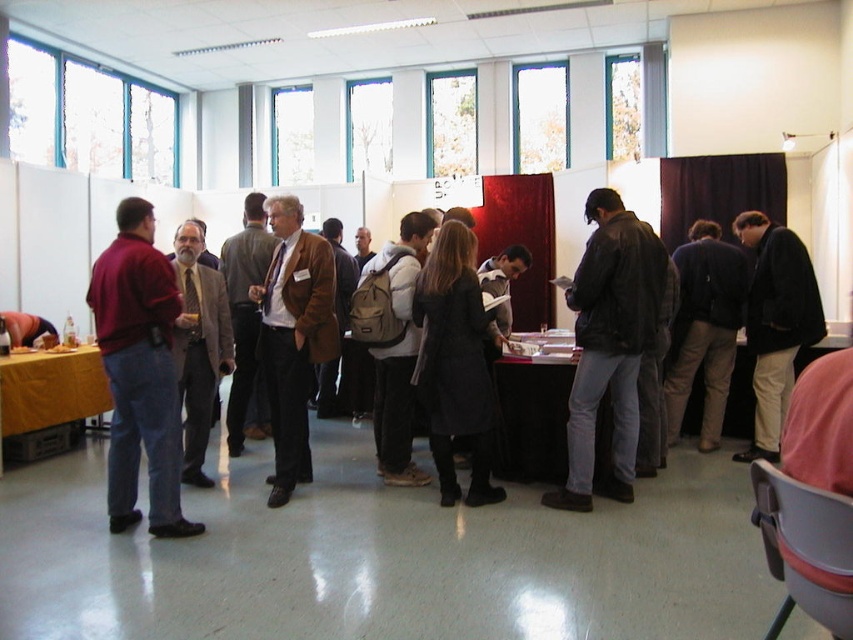
Who is taller, brown leather jacket at center or brown textured suit at center?

Standing taller between the two is brown leather jacket at center.

Does point (302, 412) come closer to viewer compared to point (181, 333)?

No, it is not.

At what (x,y) coordinates should I click in order to perform the action: click on brown leather jacket at center. Please return your answer as a coordinate pair (x, y). This screenshot has height=640, width=853. Looking at the image, I should click on (293, 337).

Is point (120, 477) closer to viewer compared to point (306, 330)?

Yes.

Does matte red shirt at left have a greater width compared to brown leather jacket at center?

No.

Is point (154, 483) farther from viewer compared to point (293, 465)?

No, (154, 483) is closer to viewer.

At what (x,y) coordinates should I click in order to perform the action: click on matte red shirt at left. Please return your answer as a coordinate pair (x, y). Looking at the image, I should click on (138, 371).

Who is more forward, (135, 460) or (86, 362)?

Point (135, 460) is more forward.

Does matte red shirt at left have a greater width compared to yellow cloth-covered table at lower left?

Correct, the width of matte red shirt at left exceeds that of yellow cloth-covered table at lower left.

Is point (132, 285) less distant than point (49, 371)?

That is True.

This screenshot has width=853, height=640. I want to click on matte red shirt at left, so click(138, 371).